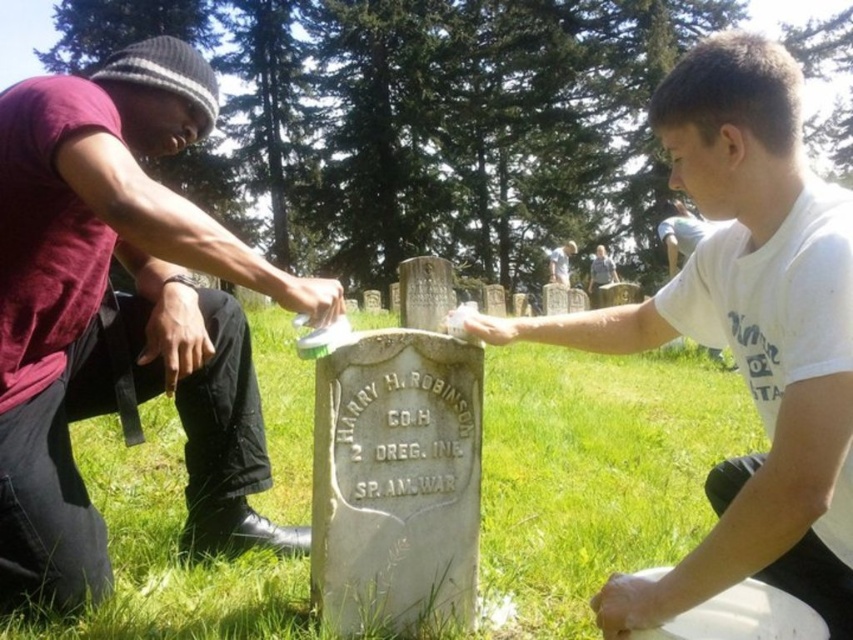
Who is higher up, white matte brush at center or light gray stone headstone at center?

light gray stone headstone at center

Can you confirm if white matte brush at center is taller than light gray stone headstone at center?

In fact, white matte brush at center may be shorter than light gray stone headstone at center.

This screenshot has height=640, width=853. What do you see at coordinates (312, 298) in the screenshot? I see `white matte brush at center` at bounding box center [312, 298].

The image size is (853, 640). What are the coordinates of `white matte brush at center` in the screenshot? It's located at (312, 298).

Does maroon cotton shirt at left appear on the left side of light gray stone headstone at center?

Yes, maroon cotton shirt at left is to the left of light gray stone headstone at center.

Does point (1, 154) come farther from viewer compared to point (563, 282)?

That is False.

Does point (7, 262) come closer to viewer compared to point (548, 257)?

Yes, point (7, 262) is in front of point (548, 257).

Identify the location of maroon cotton shirt at left. (117, 316).

Does point (798, 365) come behind point (320, 292)?

No, (798, 365) is closer to viewer.

Between white matte stone at center and white matte brush at center, which one is positioned higher?

white matte brush at center is above.

Locate an element on the screen. white matte stone at center is located at coordinates (746, 333).

Image resolution: width=853 pixels, height=640 pixels. I want to click on white matte stone at center, so click(x=746, y=333).